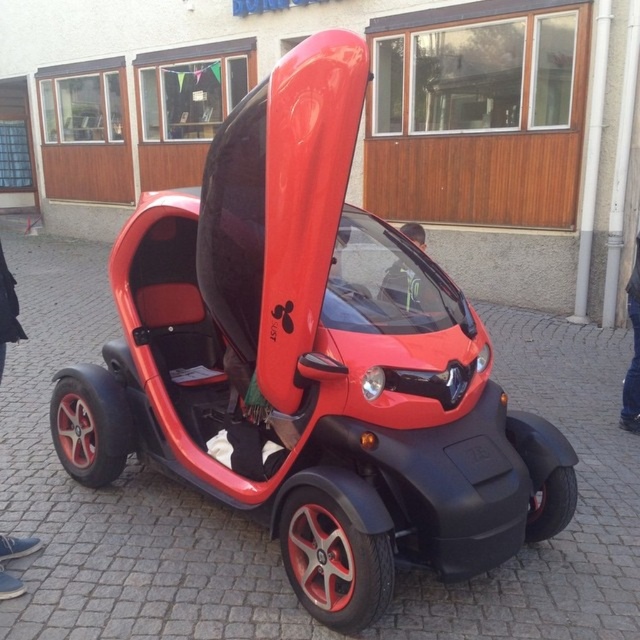
Can you confirm if red matte wheel at lower center is positioned above red matte wheel at lower left?

Incorrect, red matte wheel at lower center is not positioned above red matte wheel at lower left.

Between red matte wheel at lower center and red matte wheel at lower left, which one is positioned lower?

red matte wheel at lower center is below.

Where is `red matte wheel at lower center`? red matte wheel at lower center is located at coordinates (333, 563).

Is red matte wheel at lower left closer to camera compared to black rubber wheel at lower right?

No, it is behind black rubber wheel at lower right.

Is red matte wheel at lower left to the left of black rubber wheel at lower right from the viewer's perspective?

Correct, you'll find red matte wheel at lower left to the left of black rubber wheel at lower right.

Locate an element on the screen. This screenshot has width=640, height=640. red matte wheel at lower left is located at coordinates (90, 424).

Can you confirm if red matte wheel at lower center is positioned above black rubber wheel at lower right?

Incorrect, red matte wheel at lower center is not positioned above black rubber wheel at lower right.

Can you confirm if red matte wheel at lower center is wider than black rubber wheel at lower right?

Correct, the width of red matte wheel at lower center exceeds that of black rubber wheel at lower right.

Where is `red matte wheel at lower center`? Image resolution: width=640 pixels, height=640 pixels. red matte wheel at lower center is located at coordinates (333, 563).